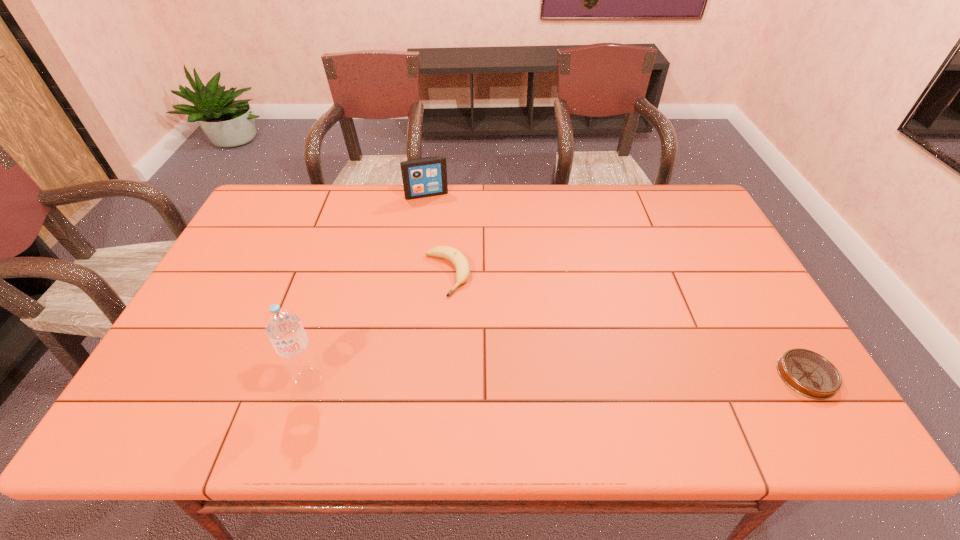
Where is `vacant space that satisfies the following two spatial constraints: 1. on the back side of the second shortest object; 2. on the left side of the water bottle`? vacant space that satisfies the following two spatial constraints: 1. on the back side of the second shortest object; 2. on the left side of the water bottle is located at coordinates (342, 274).